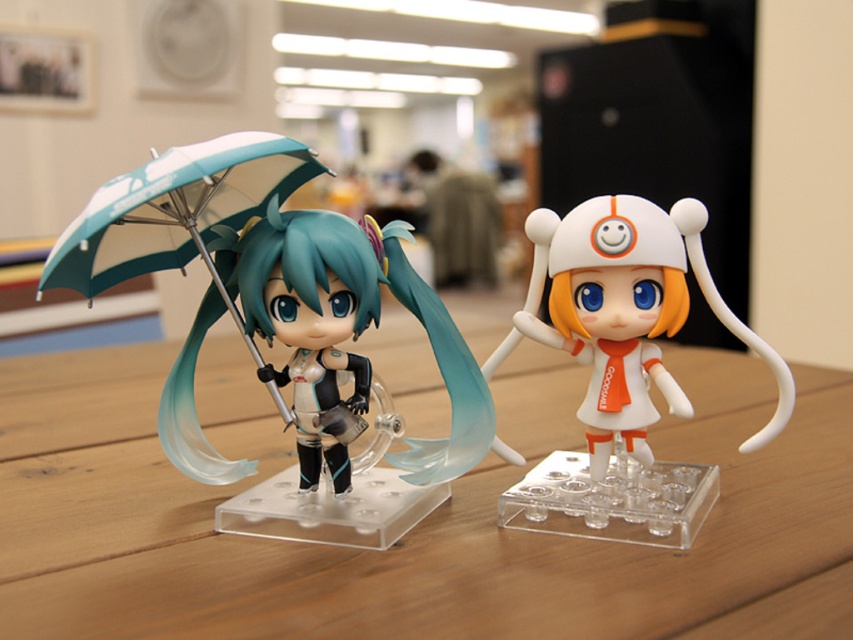
You are holding a measuring tape and need to determine if the teal matte umbrella at left is within reach from your current position. The maximum distance you can comfortably reach is 30 inches. Can you reach it?

The teal matte umbrella at left is 29.32 inches away from the viewer, which is within the 30 inches comfortable reach distance. Yes, you can reach it.

You are placing a new item on the wooden table at center and the white matte plush toy at right. Which object should you place closer to the left edge of the table?

The wooden table at center should be placed closer to the left edge of the table because it is to the left of the white matte plush toy at right.